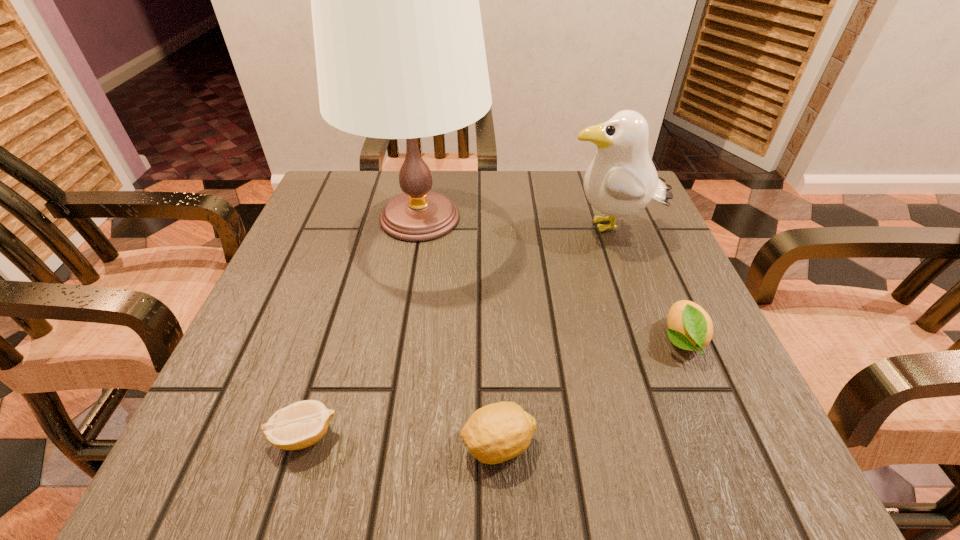
At what (x,y) coordinates should I click in order to perform the action: click on lamp. Please return your answer as a coordinate pair (x, y). Looking at the image, I should click on (399, 46).

Where is `the second tallest object`? This screenshot has height=540, width=960. the second tallest object is located at coordinates (621, 180).

Locate an element on the screen. The image size is (960, 540). the rightmost lemon is located at coordinates (690, 327).

The height and width of the screenshot is (540, 960). I want to click on the third farthest object, so click(690, 327).

Find the location of a particular element. This screenshot has height=540, width=960. the second lemon from left to right is located at coordinates (495, 433).

You are a GUI agent. You are given a task and a screenshot of the screen. Output one action in this format:
    pyautogui.click(x=<x>, y=<y>)
    Task: Click on the shortest lemon
    The height and width of the screenshot is (540, 960).
    Given the screenshot: What is the action you would take?
    pyautogui.click(x=301, y=424)

At what (x,y) coordinates should I click in order to perform the action: click on the leftmost lemon. Please return your answer as a coordinate pair (x, y). The width and height of the screenshot is (960, 540). Looking at the image, I should click on (301, 424).

At what (x,y) coordinates should I click in order to perform the action: click on vacant point located on the front of the tallest object. Please return your answer as a coordinate pair (x, y). Image resolution: width=960 pixels, height=540 pixels. Looking at the image, I should click on (380, 456).

Find the location of a particular element. This screenshot has width=960, height=540. free space located on the beak of the gull is located at coordinates (420, 228).

Where is `free space located 0.150m on the beak of the gull`? free space located 0.150m on the beak of the gull is located at coordinates (494, 228).